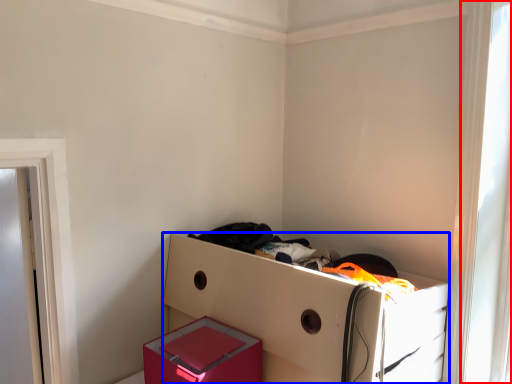
Question: Which point is further to the camera, window (highlighted by a red box) or furniture (highlighted by a blue box)?

Choices:
 (A) window
 (B) furniture

Answer: (A)